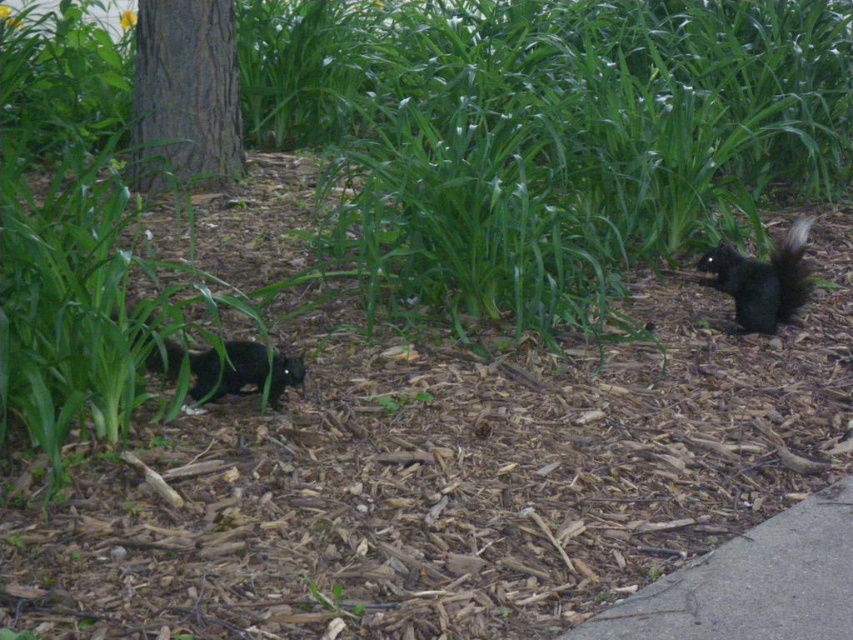
Question: Does gray concrete pavement at lower right appear under black furry tail at right?

Choices:
 (A) yes
 (B) no

Answer: (A)

Question: Which point is closer to the camera taking this photo?

Choices:
 (A) (793, 312)
 (B) (750, 301)
 (C) (596, 620)

Answer: (C)

Question: Is the position of black furry squirrel at right more distant than that of black furry tail at right?

Choices:
 (A) yes
 (B) no

Answer: (A)

Question: Estimate the real-world distances between objects in this image. Which object is closer to the black furry squirrel at right?

Choices:
 (A) black furry tail at right
 (B) gray concrete pavement at lower right

Answer: (A)

Question: Considering the relative positions of gray concrete pavement at lower right and black furry squirrel at right in the image provided, where is gray concrete pavement at lower right located with respect to black furry squirrel at right?

Choices:
 (A) right
 (B) left

Answer: (B)

Question: Which point is closer to the camera?

Choices:
 (A) (799, 234)
 (B) (781, 316)

Answer: (B)